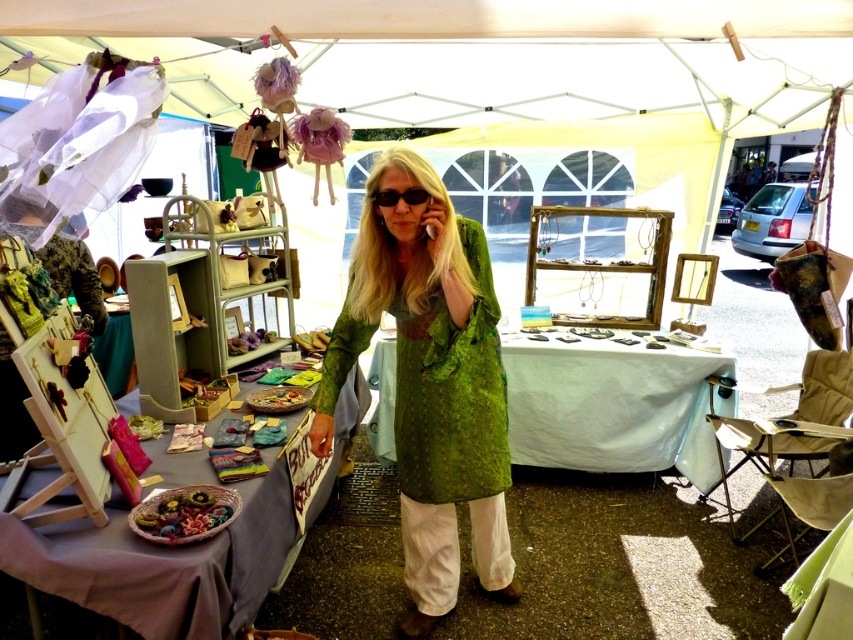
Can you confirm if green textured dress at center is wider than black plastic goggles at center?

Indeed, green textured dress at center has a greater width compared to black plastic goggles at center.

Between point (407, 525) and point (393, 200), which one is positioned in front?

Point (393, 200) is more forward.

At what (x,y) coordinates should I click in order to perform the action: click on green textured dress at center. Please return your answer as a coordinate pair (x, y). This screenshot has height=640, width=853. Looking at the image, I should click on (430, 381).